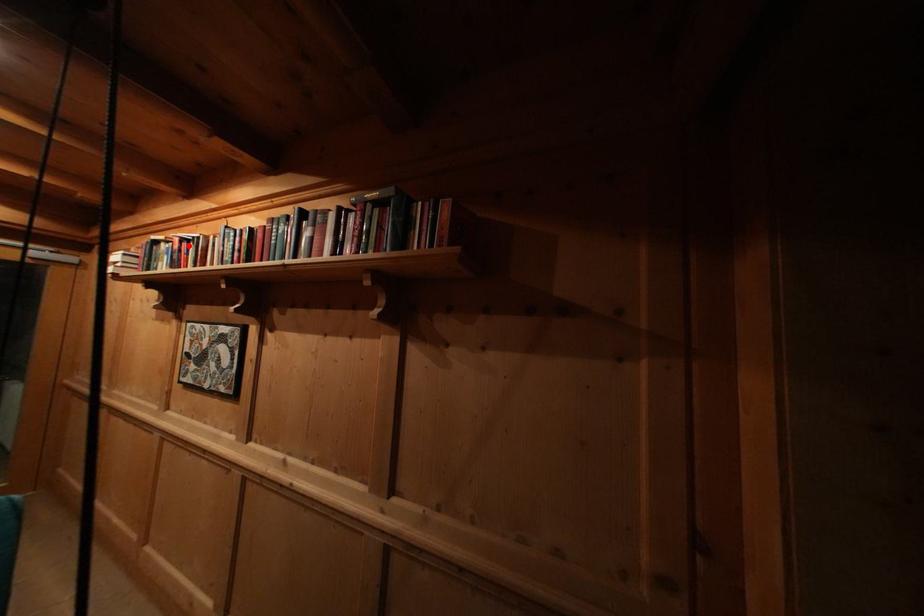
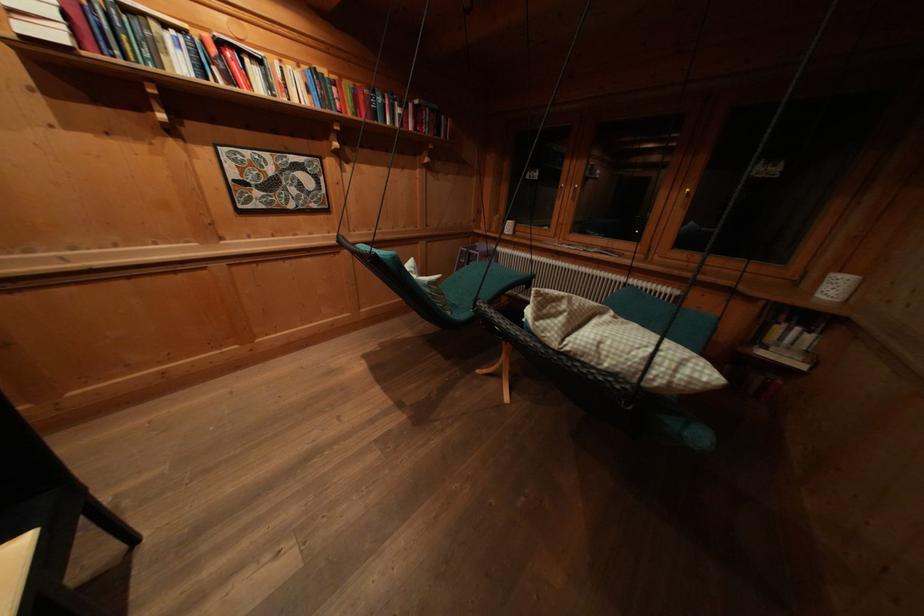
Locate, in the second image, the point that corresponds to the highlighted location in the first image.

(225, 47)